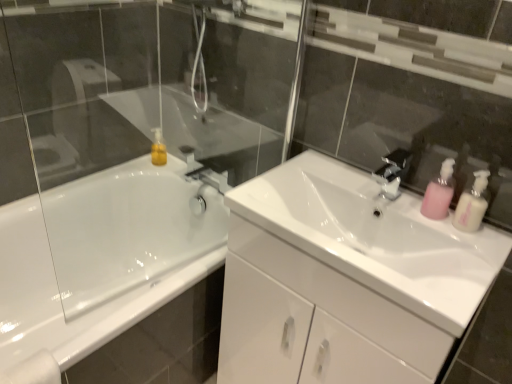
Question: Does white glossy sink at center have a smaller size compared to white glossy bathtub at left?

Choices:
 (A) yes
 (B) no

Answer: (A)

Question: Can you confirm if white glossy sink at center is wider than white glossy bathtub at left?

Choices:
 (A) yes
 (B) no

Answer: (B)

Question: Does white glossy sink at center touch white glossy bathtub at left?

Choices:
 (A) yes
 (B) no

Answer: (B)

Question: Are white glossy sink at center and white glossy bathtub at left far apart?

Choices:
 (A) no
 (B) yes

Answer: (A)

Question: Is white glossy bathtub at left at the back of white glossy sink at center?

Choices:
 (A) no
 (B) yes

Answer: (A)

Question: Does white glossy sink at center have a larger size compared to white glossy bathtub at left?

Choices:
 (A) yes
 (B) no

Answer: (B)

Question: Is white glossy bathtub at left aimed at pink plastic soap dispenser at right, the second soap dispenser in the left-to-right sequence?

Choices:
 (A) yes
 (B) no

Answer: (B)

Question: Is white glossy bathtub at left taller than pink plastic soap dispenser at right, the second soap dispenser in the left-to-right sequence?

Choices:
 (A) yes
 (B) no

Answer: (A)

Question: Does white glossy bathtub at left have a smaller size compared to pink plastic soap dispenser at right, the first soap dispenser viewed from the right?

Choices:
 (A) no
 (B) yes

Answer: (A)

Question: Is white glossy bathtub at left positioned beyond the bounds of pink plastic soap dispenser at right, the first soap dispenser viewed from the right?

Choices:
 (A) no
 (B) yes

Answer: (B)

Question: Is pink plastic soap dispenser at right, the second soap dispenser in the left-to-right sequence, at the back of white glossy bathtub at left?

Choices:
 (A) no
 (B) yes

Answer: (A)

Question: Are white glossy bathtub at left and pink plastic soap dispenser at right, the first soap dispenser viewed from the right, located far from each other?

Choices:
 (A) no
 (B) yes

Answer: (B)

Question: Does pink plastic soap dispenser at right, the second soap dispenser in the left-to-right sequence, have a larger size compared to pink plastic soap dispenser at right, the 1th soap dispenser when ordered from left to right?

Choices:
 (A) yes
 (B) no

Answer: (B)